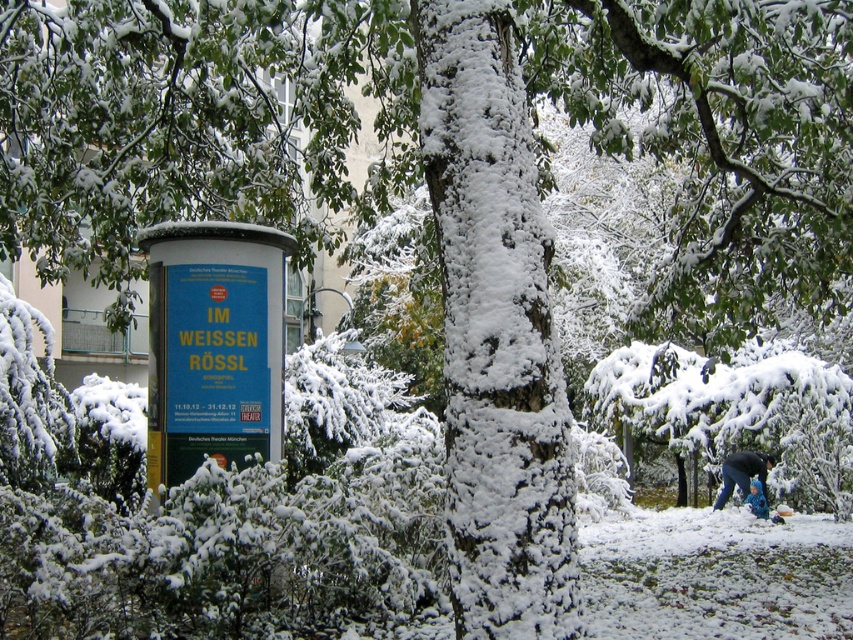
From the picture: You are an artist who wants to sketch the scene. You notice the blue paper at center and the blue fuzzy coat at lower right. Which object should you draw first if you want to capture the one that is closer to the front of the image?

The blue fuzzy coat at lower right is closer to the front of the image than the blue paper at center, so you should draw the blue fuzzy coat at lower right first.

You are an artist setting up an easel to paint the winter scene. You notice the blue paper at center and the dark blue jacket at lower right. Which object should you focus on first if you want to paint the taller object first?

The blue paper at center is taller than the dark blue jacket at lower right, so you should focus on painting the blue paper at center first.